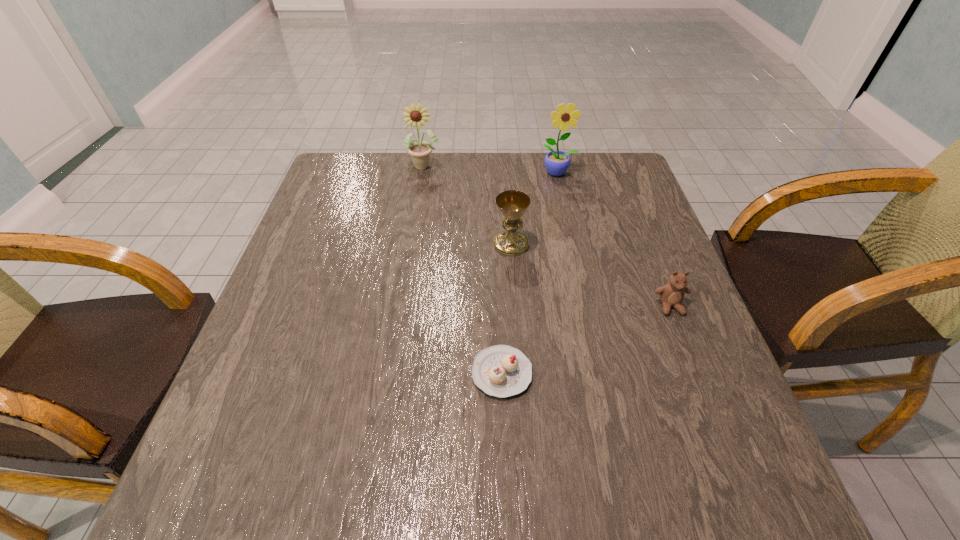
Image resolution: width=960 pixels, height=540 pixels. I want to click on object identified as the fourth closest to the right sunflower, so click(x=502, y=371).

The width and height of the screenshot is (960, 540). Identify the location of the second closest object to the cupcake. (671, 294).